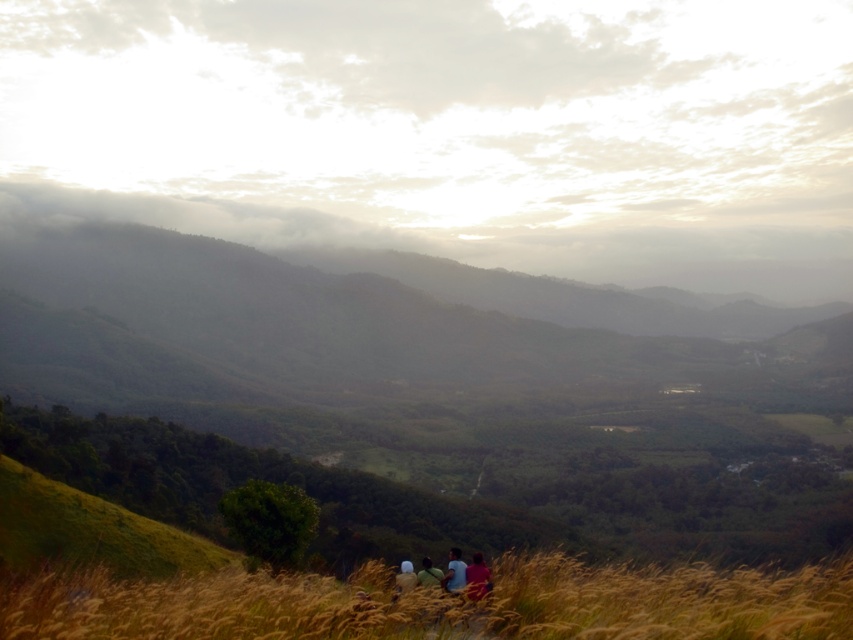
You are a photographer trying to capture the group of people in the scene. You notice the blue fabric person at lower center and the matte black shirt at lower center. Which of these two individuals appears bigger in the photo?

The blue fabric person at lower center appears bigger in the photo compared to the matte black shirt at lower center because it has a larger size.

You are standing in the field of tall golden grasses and want to walk towards the horizon where the small group of people is walking. There are two points marked in the scene, point A at coordinates point (x=393, y=579) and point B at coordinates point (x=424, y=573). Which point should you head towards to get closer to the group?

Point A at coordinates point (x=393, y=579) is closer to the viewer than point B at coordinates point (x=424, y=573). Since the group is walking towards the horizon, heading towards the closer point A would mean you are moving in the direction away from the group. Therefore, you should head towards point B at coordinates point (x=424, y=573) to get closer to the group.